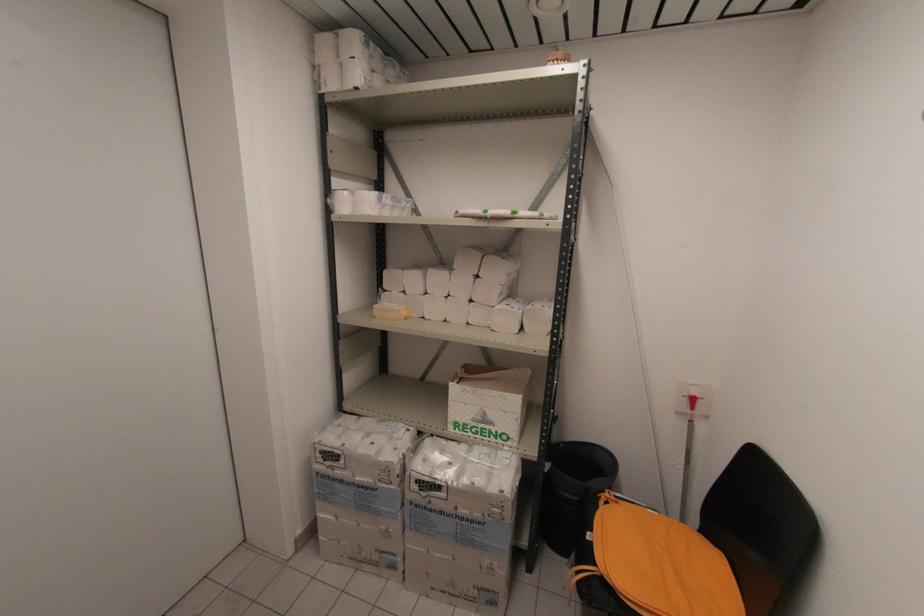
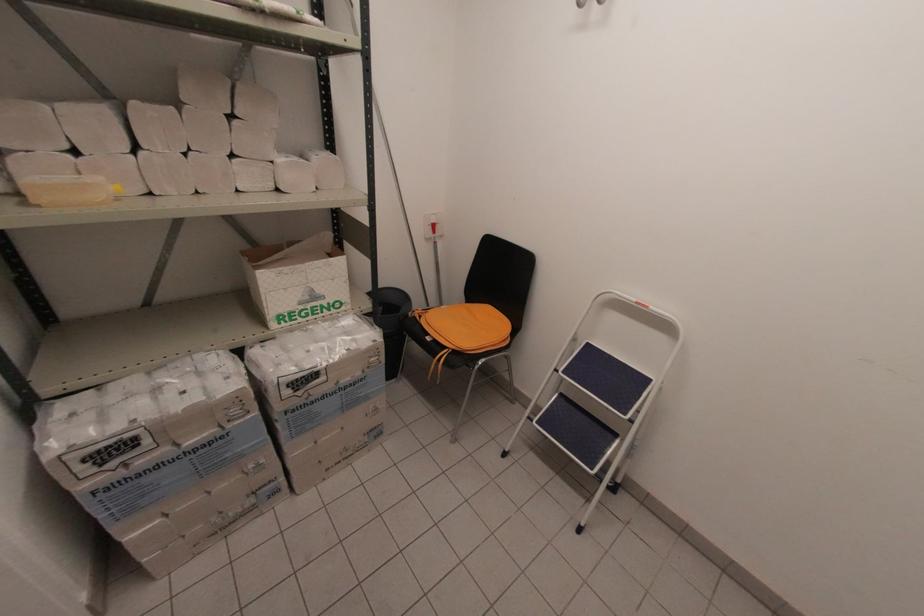
In the second image, find the point that corresponds to point (406, 313) in the first image.

(116, 188)